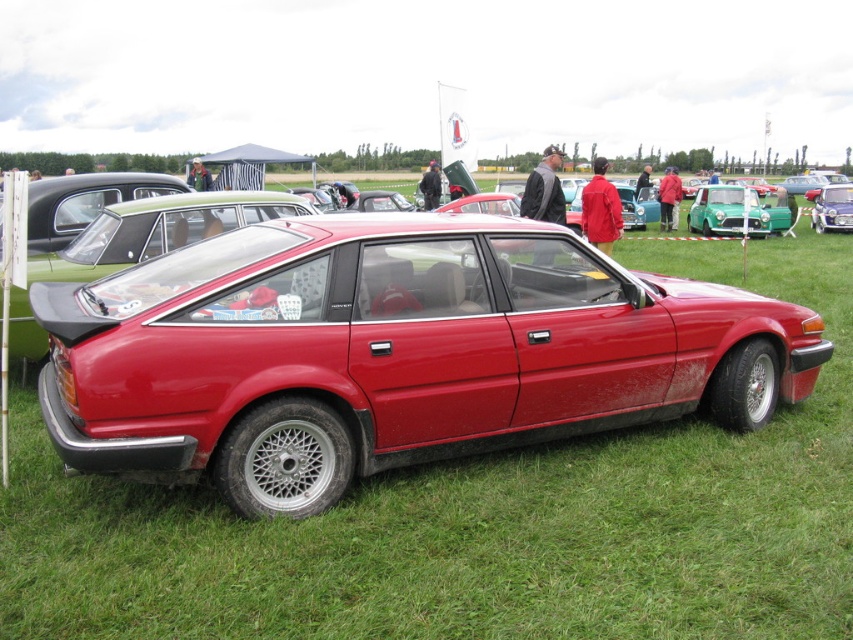
Does green matte car at center appear under metallic silver car at center?

Yes, green matte car at center is below metallic silver car at center.

Is green matte car at center to the left of metallic silver car at center from the viewer's perspective?

Indeed, green matte car at center is positioned on the left side of metallic silver car at center.

Which is in front, point (782, 204) or point (827, 189)?

Positioned in front is point (782, 204).

This screenshot has height=640, width=853. What are the coordinates of `green matte car at center` in the screenshot? It's located at (738, 211).

Between point (51, 422) and point (735, 202), which one is positioned behind?

The point (735, 202) is more distant.

Is glossy red car at center further to camera compared to green matte car at center?

No, it is in front of green matte car at center.

The image size is (853, 640). Find the location of `glossy red car at center`. glossy red car at center is located at coordinates (392, 353).

Is glossy red car at center bigger than metallic silver car at center?

Indeed, glossy red car at center has a larger size compared to metallic silver car at center.

Can you confirm if glossy red car at center is wider than metallic silver car at center?

Correct, the width of glossy red car at center exceeds that of metallic silver car at center.

Where is `glossy red car at center`? Image resolution: width=853 pixels, height=640 pixels. glossy red car at center is located at coordinates (392, 353).